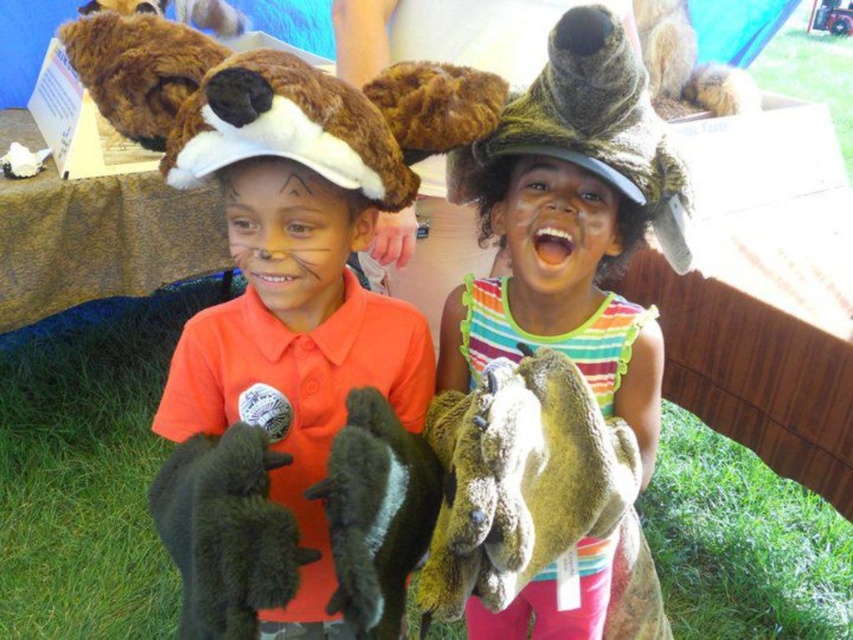
Is fuzzy brown hat at upper left bigger than dark green plush fish at center?

Yes, fuzzy brown hat at upper left is bigger than dark green plush fish at center.

Who is more forward, [200,348] or [368,458]?

Positioned in front is point [368,458].

Identify the location of fuzzy brown hat at upper left. (292, 298).

Where is `fuzzy brown hat at upper left`? fuzzy brown hat at upper left is located at coordinates (292, 298).

Between green fuzzy puppet at center and dark green plush rabbit at lower left, which one is positioned higher?

Positioned higher is dark green plush rabbit at lower left.

Is point (521, 400) farther from camera compared to point (206, 536)?

That is True.

Does point (432, 440) come in front of point (219, 572)?

No.

The height and width of the screenshot is (640, 853). I want to click on green fuzzy puppet at center, so (x=521, y=483).

Does fuzzy brown hat at upper left come in front of green fuzzy puppet at center?

Yes, it is.

Which is behind, point (328, 403) or point (473, 492)?

Positioned behind is point (328, 403).

Where is `fuzzy brown hat at upper left`? Image resolution: width=853 pixels, height=640 pixels. fuzzy brown hat at upper left is located at coordinates (292, 298).